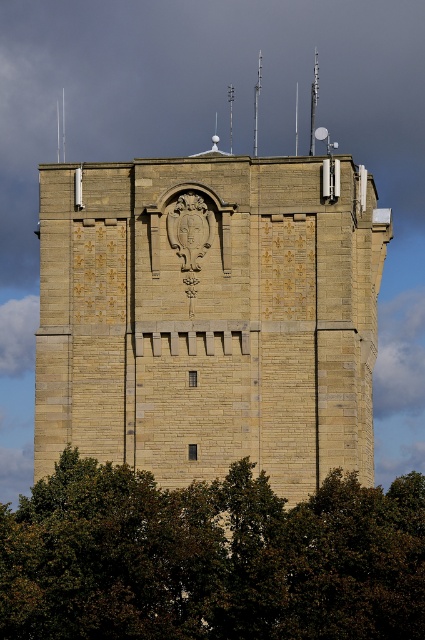
Question: Which object appears farthest from the camera in this image?

Choices:
 (A) green leafy tree at lower center
 (B) brown stone bell tower at center

Answer: (B)

Question: Can you confirm if brown stone bell tower at center is positioned to the right of green leafy tree at lower center?

Choices:
 (A) no
 (B) yes

Answer: (A)

Question: Which object appears closest to the camera in this image?

Choices:
 (A) green leafy tree at lower center
 (B) brown stone bell tower at center

Answer: (A)

Question: Does brown stone bell tower at center have a smaller size compared to green leafy tree at lower center?

Choices:
 (A) yes
 (B) no

Answer: (B)

Question: Can you confirm if brown stone bell tower at center is wider than green leafy tree at lower center?

Choices:
 (A) yes
 (B) no

Answer: (B)